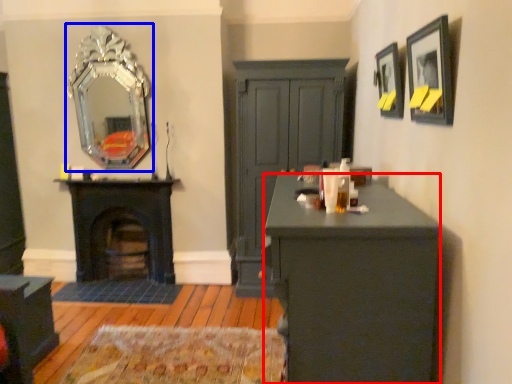
Question: Which point is further to the camera, desk (highlighted by a red box) or mirror (highlighted by a blue box)?

Choices:
 (A) desk
 (B) mirror

Answer: (B)